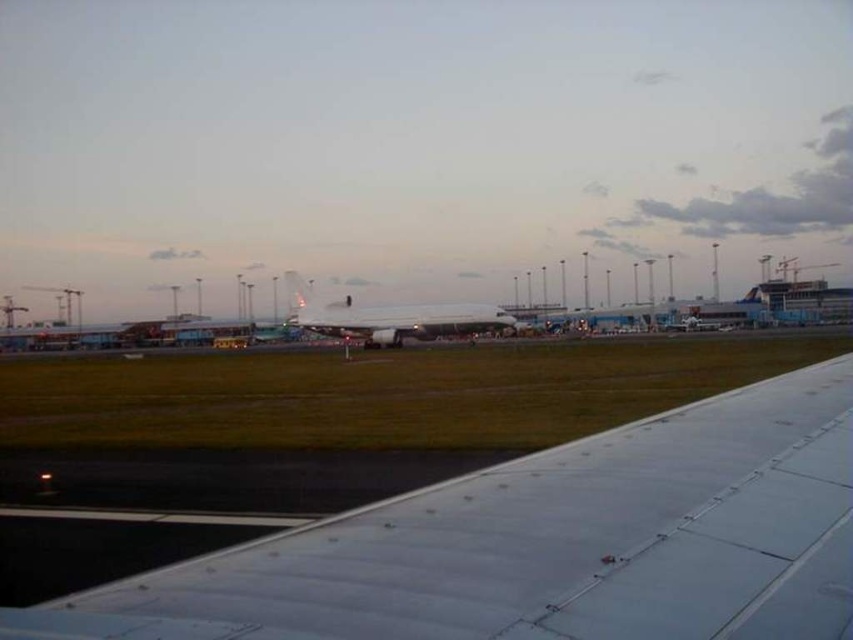
You are a passenger seated near the window of an airplane. You notice two objects outside your window. The first is the white metallic wing at lower right, and the second is the white glossy airplane at center. Which object is positioned to the right side of the other?

The white metallic wing at lower right is positioned to the right of the white glossy airplane at center.

You are a pilot preparing for takeoff and notice two aircraft in your view. The white metallic wing at lower right and the white glossy airplane at center. Which one is closer to you?

The white metallic wing at lower right is closer to you because it appears smaller than the white glossy airplane at center, which is larger and therefore farther away.

You are a passenger seated in the window seat of an airplane. You want to reach out and touch the white metallic wing at lower right. Considering your arm length is 2.5 feet, can you safely reach it?

The white metallic wing at lower right is 3.70 feet away from the viewer. Since your arm length is only 2.5 feet, you cannot safely reach it.